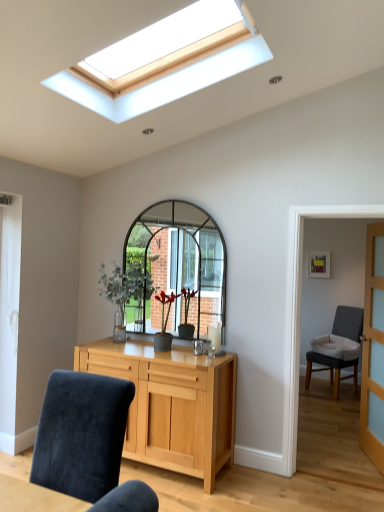
Identify the location of vacant area that is situated to the right of matte gray vase at center. (180, 351).